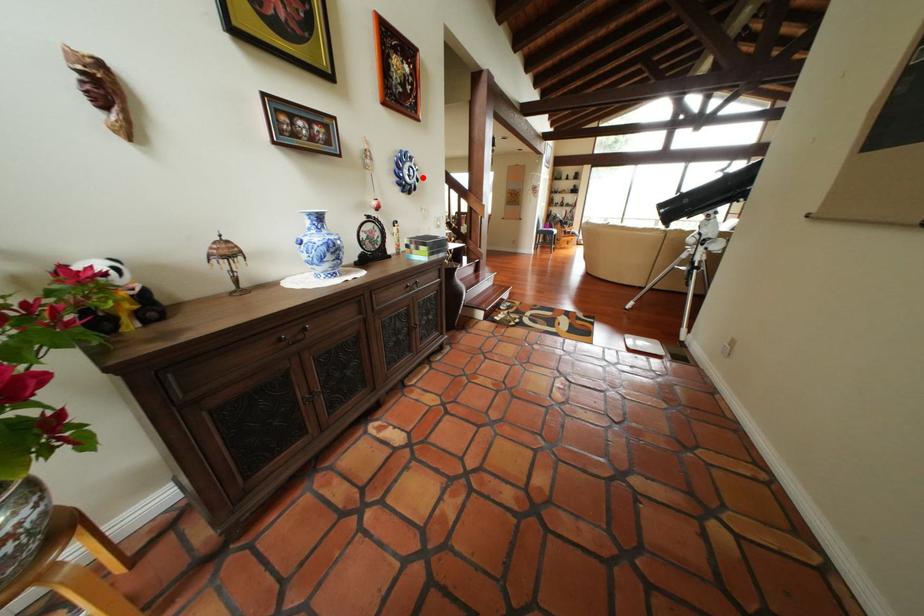
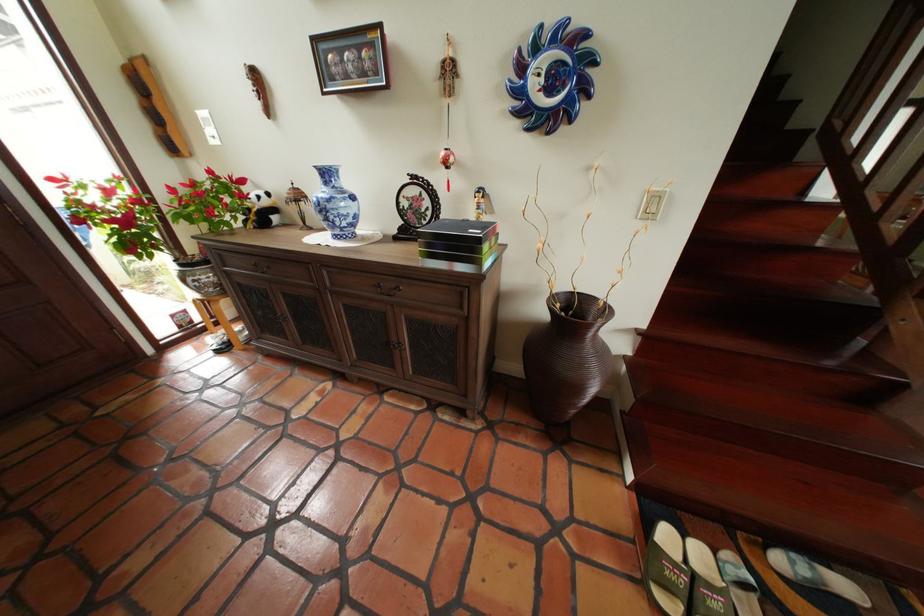
Question: I am providing you with two images of the same scene from different viewpoints. In image1, a red point is highlighted. Considering the same 3D point in image2, which of the following is correct?

Choices:
 (A) It is closer
 (B) It is farther

Answer: (B)